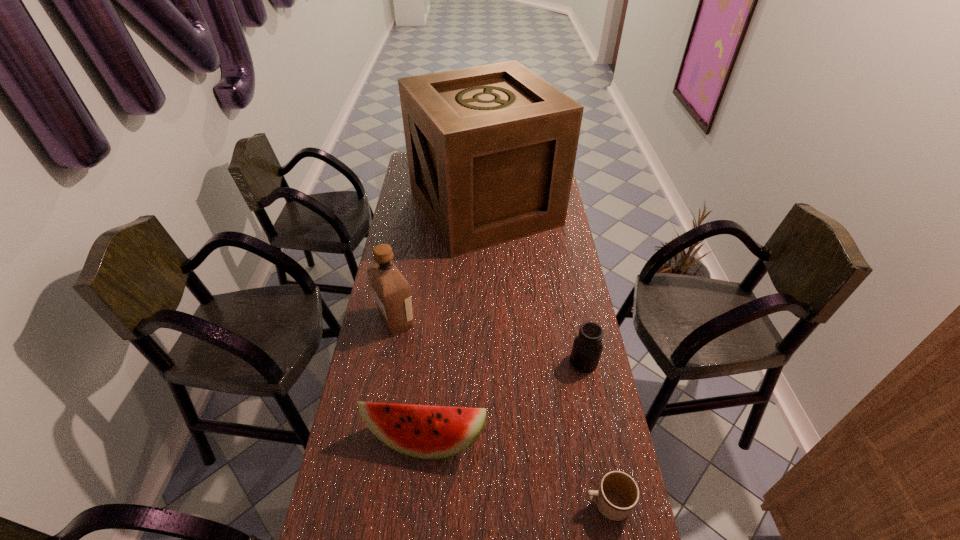
Where is `vacant space located 0.120m on the back of the box`? vacant space located 0.120m on the back of the box is located at coordinates (484, 157).

Find the location of a particular element. The height and width of the screenshot is (540, 960). free space located 0.130m on the front-facing side of the liquor is located at coordinates (454, 321).

You are a GUI agent. You are given a task and a screenshot of the screen. Output one action in this format:
    pyautogui.click(x=<x>, y=<y>)
    Task: Click on the vacant space located on the outer rind of the fourth farthest object
    
    Given the screenshot: What is the action you would take?
    pyautogui.click(x=418, y=523)

Identify the location of free region located on the back of the third nearest object. The width and height of the screenshot is (960, 540). (572, 306).

You are a GUI agent. You are given a task and a screenshot of the screen. Output one action in this format:
    pyautogui.click(x=<x>, y=<y>)
    Task: Click on the vacant space located 0.100m on the side of the shortest object with the handle
    
    Given the screenshot: What is the action you would take?
    pyautogui.click(x=543, y=504)

I want to click on free space located on the side of the shortest object with the handle, so click(496, 504).

At what (x,y) coordinates should I click in order to perform the action: click on vacant point located 0.140m on the side of the shortest object with the handle. Please return your answer as a coordinate pair (x, y). Looking at the image, I should click on (527, 504).

Identify the location of object that is positioned at the far edge. This screenshot has height=540, width=960. (491, 149).

Where is `box present at the left edge`? box present at the left edge is located at coordinates click(491, 149).

Find the location of a particular element. liquor present at the left edge is located at coordinates (391, 290).